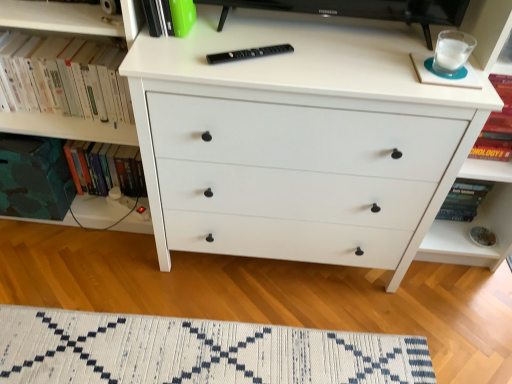
This screenshot has height=384, width=512. Describe the element at coordinates (105, 168) in the screenshot. I see `hardcover book at left, marked as the 3th book in a front-to-back arrangement` at that location.

What are the coordinates of `white matte chest of drawers at center` in the screenshot? It's located at (298, 140).

How much space does green matte book at upper center, which is counted as the third book, starting from the back, occupy horizontally?

green matte book at upper center, which is counted as the third book, starting from the back, is 5.15 inches in width.

The width and height of the screenshot is (512, 384). Find the location of `hardcover book at left, arranged as the 1th book when viewed from the back`. hardcover book at left, arranged as the 1th book when viewed from the back is located at coordinates (105, 168).

Are green matte book at upper center, which is counted as the third book, starting from the back, and white paperbacks at left, the 2th book positioned from the back, far apart?

That's not correct — green matte book at upper center, which is counted as the third book, starting from the back, is a little close to white paperbacks at left, the 2th book positioned from the back.

From a real-world perspective, who is located lower, green matte book at upper center, which is counted as the first book, starting from the front, or white paperbacks at left, the 2th book positioned from the back?

white paperbacks at left, the 2th book positioned from the back, is physically lower.

Considering the relative sizes of green matte book at upper center, which is counted as the third book, starting from the back, and white paperbacks at left, acting as the second book starting from the front, in the image provided, is green matte book at upper center, which is counted as the third book, starting from the back, wider than white paperbacks at left, acting as the second book starting from the front,?

Incorrect, the width of green matte book at upper center, which is counted as the third book, starting from the back, does not surpass that of white paperbacks at left, acting as the second book starting from the front.

Can you tell me how much white paperbacks at left, acting as the second book starting from the front, and hardcover book at left, marked as the 3th book in a front-to-back arrangement, differ in facing direction?

The angular difference between white paperbacks at left, acting as the second book starting from the front, and hardcover book at left, marked as the 3th book in a front-to-back arrangement, is 0.0011 degrees.

Is white paperbacks at left, the 2th book positioned from the back, not near hardcover book at left, marked as the 3th book in a front-to-back arrangement?

Actually, white paperbacks at left, the 2th book positioned from the back, and hardcover book at left, marked as the 3th book in a front-to-back arrangement, are a little close together.

From the image's perspective, is white paperbacks at left, acting as the second book starting from the front, positioned above or below hardcover book at left, marked as the 3th book in a front-to-back arrangement?

white paperbacks at left, acting as the second book starting from the front, is above hardcover book at left, marked as the 3th book in a front-to-back arrangement.

Based on the photo, is white paperbacks at left, the 2th book positioned from the back, oriented away from hardcover book at left, marked as the 3th book in a front-to-back arrangement?

No, white paperbacks at left, the 2th book positioned from the back, is not facing the opposite direction of hardcover book at left, marked as the 3th book in a front-to-back arrangement.

From the image's perspective, would you say white woven mat at lower center is positioned over white paperbacks at left, acting as the second book starting from the front?

No.

Is white woven mat at lower center facing away from white paperbacks at left, acting as the second book starting from the front?

white woven mat at lower center is not turned away from white paperbacks at left, acting as the second book starting from the front.

Does white woven mat at lower center come behind white paperbacks at left, the 2th book positioned from the back?

Yes, white woven mat at lower center is behind white paperbacks at left, the 2th book positioned from the back.

Does point (358, 381) come closer to viewer compared to point (71, 76)?

No, it is behind (71, 76).

From the image's perspective, is hardcover book at left, arranged as the 1th book when viewed from the back, under white matte chest of drawers at center?

No, from the image's perspective, hardcover book at left, arranged as the 1th book when viewed from the back, is not beneath white matte chest of drawers at center.

Where is `the chest of drawers lying below the hardcover book at left, arranged as the 1th book when viewed from the back (from the image's perspective)`? the chest of drawers lying below the hardcover book at left, arranged as the 1th book when viewed from the back (from the image's perspective) is located at coordinates (298, 140).

Which of these two, hardcover book at left, marked as the 3th book in a front-to-back arrangement, or white matte chest of drawers at center, is smaller?

hardcover book at left, marked as the 3th book in a front-to-back arrangement.

Considering the positions of objects hardcover book at left, marked as the 3th book in a front-to-back arrangement, and white matte chest of drawers at center in the image provided, who is behind, hardcover book at left, marked as the 3th book in a front-to-back arrangement, or white matte chest of drawers at center?

Positioned behind is hardcover book at left, marked as the 3th book in a front-to-back arrangement.

Which object is positioned more to the left, white woven mat at lower center or camouflage fabric book at lower left?

camouflage fabric book at lower left.

In the scene shown: Between white woven mat at lower center and camouflage fabric book at lower left, which one has larger size?

camouflage fabric book at lower left.

Does white woven mat at lower center turn towards camouflage fabric book at lower left?

No, white woven mat at lower center is not aimed at camouflage fabric book at lower left.

From the picture: Which of these two, white paperbacks at left, acting as the second book starting from the front, or green matte book at upper center, which is counted as the first book, starting from the front, is wider?

Wider between the two is white paperbacks at left, acting as the second book starting from the front.

Is white paperbacks at left, the 2th book positioned from the back, facing towards green matte book at upper center, which is counted as the first book, starting from the front?

No, white paperbacks at left, the 2th book positioned from the back, is not aimed at green matte book at upper center, which is counted as the first book, starting from the front.

Can you confirm if white paperbacks at left, the 2th book positioned from the back, is taller than green matte book at upper center, which is counted as the third book, starting from the back?

Yes, white paperbacks at left, the 2th book positioned from the back, is taller than green matte book at upper center, which is counted as the third book, starting from the back.

Which is behind, point (89, 55) or point (170, 7)?

The point (89, 55) is more distant.

Is hardcover book at left, marked as the 3th book in a front-to-back arrangement, facing towards white woven mat at lower center?

No.

Is hardcover book at left, marked as the 3th book in a front-to-back arrangement, at the right side of white woven mat at lower center?

Incorrect, hardcover book at left, marked as the 3th book in a front-to-back arrangement, is not on the right side of white woven mat at lower center.

From the image's perspective, is hardcover book at left, marked as the 3th book in a front-to-back arrangement, over white woven mat at lower center?

Yes, from the image's perspective, hardcover book at left, marked as the 3th book in a front-to-back arrangement, is on top of white woven mat at lower center.

This screenshot has height=384, width=512. What are the coordinates of `the 2nd book to the right when counting from the white paperbacks at left, the 2th book positioned from the back` in the screenshot? It's located at (169, 17).

This screenshot has width=512, height=384. Identify the location of book on the left of hardcover book at left, marked as the 3th book in a front-to-back arrangement. (63, 78).

When comparing their distances from camouflage fabric book at lower left, does white matte chest of drawers at center or hardcover book at left, arranged as the 1th book when viewed from the back, seem further?

The object further to camouflage fabric book at lower left is white matte chest of drawers at center.

Based on their spatial positions, is green matte book at upper center, which is counted as the first book, starting from the front, or camouflage fabric book at lower left closer to white woven mat at lower center?

camouflage fabric book at lower left lies closer to white woven mat at lower center than the other object.

When comparing their distances from white matte chest of drawers at center, does green matte book at upper center, which is counted as the first book, starting from the front, or white paperbacks at left, acting as the second book starting from the front, seem closer?

green matte book at upper center, which is counted as the first book, starting from the front, is positioned closer to the anchor white matte chest of drawers at center.

Estimate the real-world distances between objects in this image. Which object is closer to white paperbacks at left, the 2th book positioned from the back, green matte book at upper center, which is counted as the third book, starting from the back, or white matte chest of drawers at center?

Based on the image, green matte book at upper center, which is counted as the third book, starting from the back, appears to be nearer to white paperbacks at left, the 2th book positioned from the back.

Estimate the real-world distances between objects in this image. Which object is further from white paperbacks at left, the 2th book positioned from the back, camouflage fabric book at lower left or white woven mat at lower center?

white woven mat at lower center is positioned further to the anchor white paperbacks at left, the 2th book positioned from the back.

From the image, which object appears to be nearer to hardcover book at left, marked as the 3th book in a front-to-back arrangement, green matte book at upper center, which is counted as the third book, starting from the back, or camouflage fabric book at lower left?

Among the two, camouflage fabric book at lower left is located nearer to hardcover book at left, marked as the 3th book in a front-to-back arrangement.

Estimate the real-world distances between objects in this image. Which object is closer to white paperbacks at left, acting as the second book starting from the front, white matte chest of drawers at center or camouflage fabric book at lower left?

Based on the image, camouflage fabric book at lower left appears to be nearer to white paperbacks at left, acting as the second book starting from the front.

From the image, which object appears to be nearer to green matte book at upper center, which is counted as the first book, starting from the front, white woven mat at lower center or hardcover book at left, arranged as the 1th book when viewed from the back?

hardcover book at left, arranged as the 1th book when viewed from the back.

Find the location of a particular element. The width and height of the screenshot is (512, 384). paperback book between white paperbacks at left, acting as the second book starting from the front, and white woven mat at lower center from top to bottom is located at coordinates (34, 178).

This screenshot has height=384, width=512. I want to click on paperback book between hardcover book at left, arranged as the 1th book when viewed from the back, and white woven mat at lower center in the up-down direction, so 34,178.

Locate an element on the screen. chest of drawers between hardcover book at left, arranged as the 1th book when viewed from the back, and white woven mat at lower center, in the vertical direction is located at coordinates (298, 140).

Where is `mat between camouflage fabric book at lower left and white matte chest of drawers at center from left to right`? This screenshot has width=512, height=384. mat between camouflage fabric book at lower left and white matte chest of drawers at center from left to right is located at coordinates (196, 351).